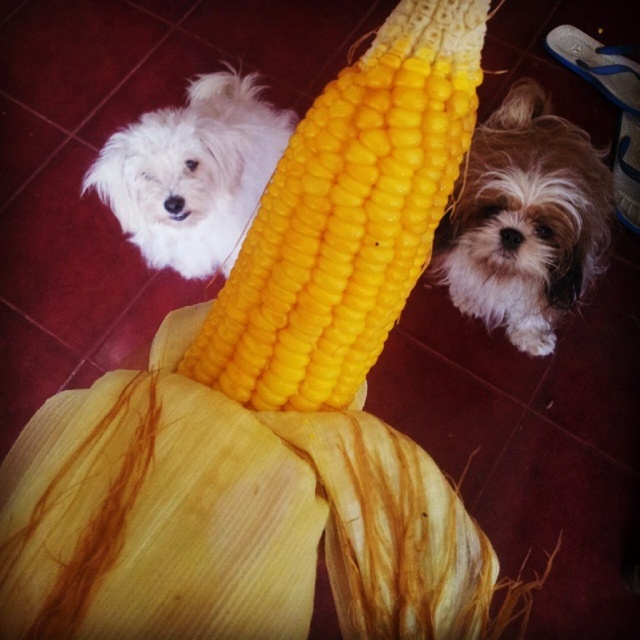
Between yellow matte corn at center and fuzzy brown dog at lower right, which one is positioned higher?

fuzzy brown dog at lower right is higher up.

Can you confirm if yellow matte corn at center is bigger than fuzzy brown dog at lower right?

No.

Who is more distant from viewer, (305, 115) or (588, 195)?

The point (588, 195) is behind.

What are the coordinates of `yellow matte corn at center` in the screenshot? It's located at coord(348,216).

Is yellow corn at center thinner than fuzzy brown dog at lower right?

Correct, yellow corn at center's width is less than fuzzy brown dog at lower right's.

Which of these two, yellow corn at center or fuzzy brown dog at lower right, stands shorter?

Standing shorter between the two is yellow corn at center.

Describe the element at coordinates (227, 516) in the screenshot. I see `yellow corn at center` at that location.

At what (x,y) coordinates should I click in order to perform the action: click on yellow corn at center. Please return your answer as a coordinate pair (x, y). The width and height of the screenshot is (640, 640). Looking at the image, I should click on (227, 516).

Does yellow corn at center lie behind white fluffy dog at upper left?

No, it is not.

The image size is (640, 640). Find the location of `yellow corn at center`. yellow corn at center is located at coordinates (227, 516).

Find the location of a particular element. This screenshot has height=640, width=640. yellow corn at center is located at coordinates (227, 516).

Where is `yellow corn at center`? The height and width of the screenshot is (640, 640). yellow corn at center is located at coordinates (227, 516).